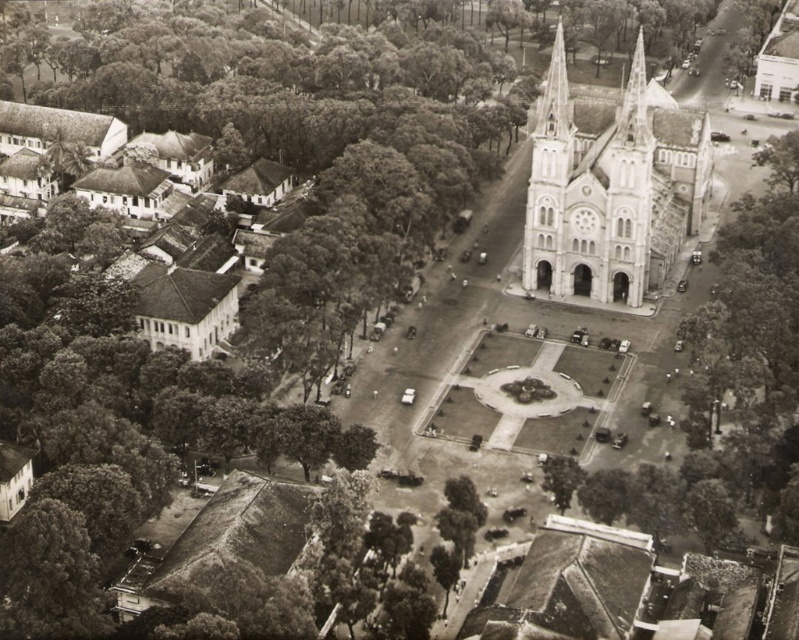
Question: Which point is farther from the camera taking this photo?

Choices:
 (A) (0, 614)
 (B) (646, 212)

Answer: (B)

Question: Is stone church at center further to the viewer compared to dark green leafy tree at lower left?

Choices:
 (A) yes
 (B) no

Answer: (A)

Question: Estimate the real-world distances between objects in this image. Which object is farther from the dark green leafy tree at lower left?

Choices:
 (A) stone church at center
 (B) green leafy tree at center

Answer: (A)

Question: Estimate the real-world distances between objects in this image. Which object is farther from the stone church at center?

Choices:
 (A) dark green leafy tree at lower left
 (B) green leafy tree at center

Answer: (A)

Question: Is dark green leafy tree at lower left to the right of green leafy tree at center from the viewer's perspective?

Choices:
 (A) yes
 (B) no

Answer: (B)

Question: Is stone church at center below dark green leafy tree at lower left?

Choices:
 (A) no
 (B) yes

Answer: (A)